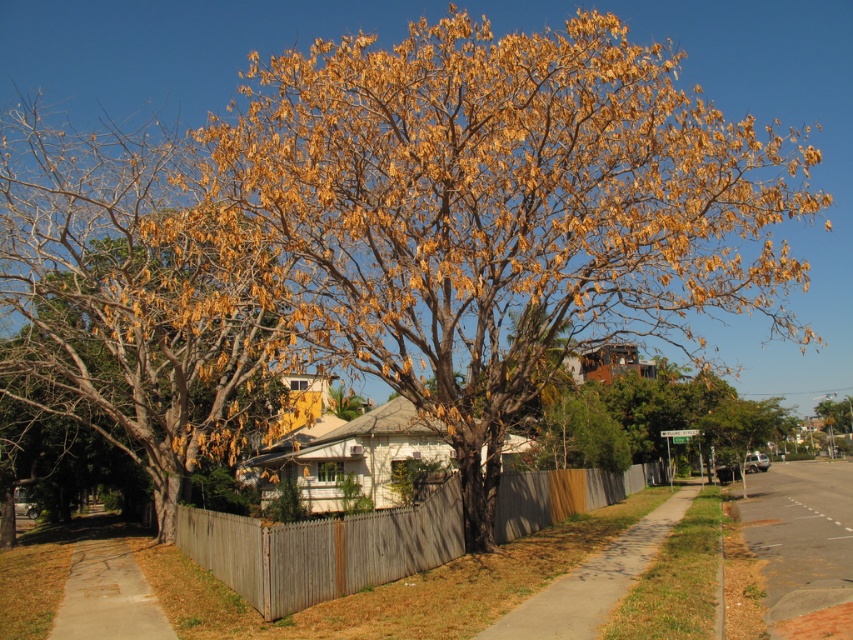
Question: Does brown/dried leaves at center appear on the right side of dark gray asphalt at lower right?

Choices:
 (A) no
 (B) yes

Answer: (A)

Question: Which object is farther from the camera taking this photo?

Choices:
 (A) concrete sidewalk at lower left
 (B) dark gray asphalt at lower right

Answer: (A)

Question: Does brown/dried leaves at center have a lesser width compared to golden-brown bark tree at center?

Choices:
 (A) no
 (B) yes

Answer: (A)

Question: Is brown/dried leaves at center to the right of dark gray asphalt at lower right from the viewer's perspective?

Choices:
 (A) yes
 (B) no

Answer: (B)

Question: Which of the following is the farthest from the observer?

Choices:
 (A) wooden picket fence at center
 (B) dark gray asphalt at lower right
 (C) concrete sidewalk at lower left
 (D) brown wooden fence at lower center

Answer: (A)

Question: Which object is the closest to the concrete sidewalk at lower left?

Choices:
 (A) brown/dried leaves at center
 (B) brown wooden fence at lower center
 (C) dark gray asphalt at lower right

Answer: (A)